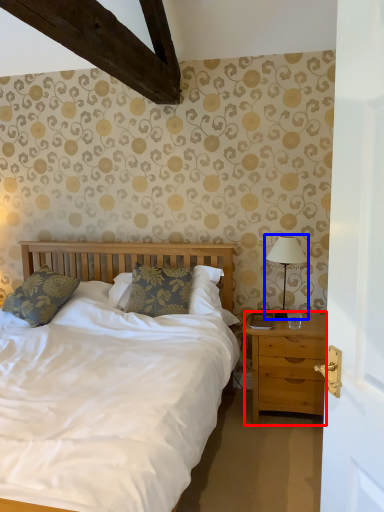
Question: Which of the following is the farthest to the observer, nightstand (highlighted by a red box) or bedside lamp (highlighted by a blue box)?

Choices:
 (A) nightstand
 (B) bedside lamp

Answer: (B)